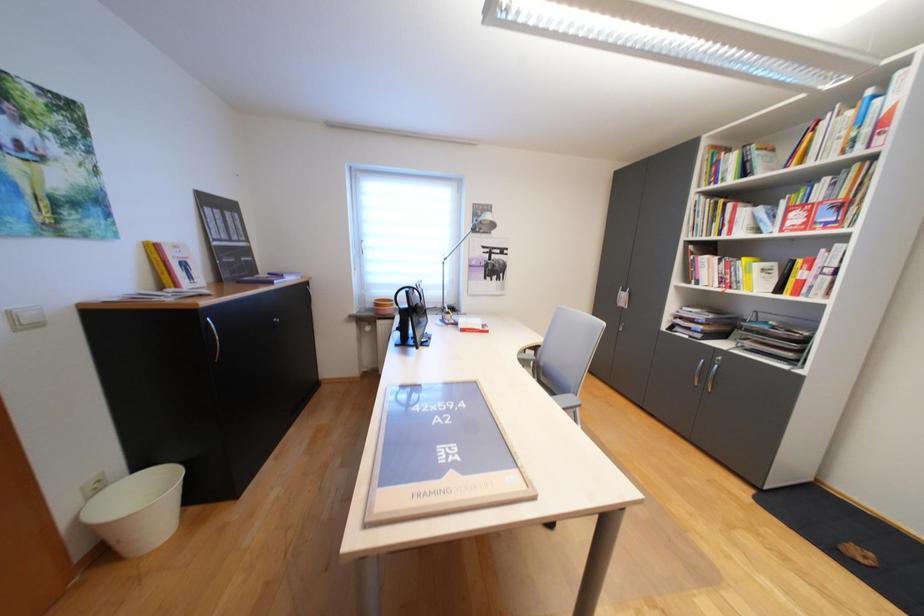
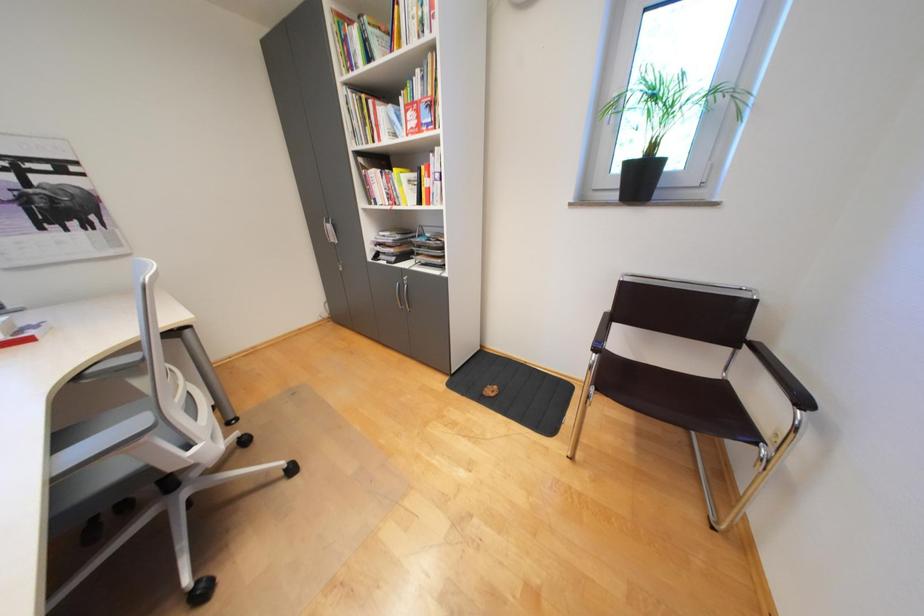
Based on the continuous images, in which direction is the camera rotating?

The camera rotated toward right-down.